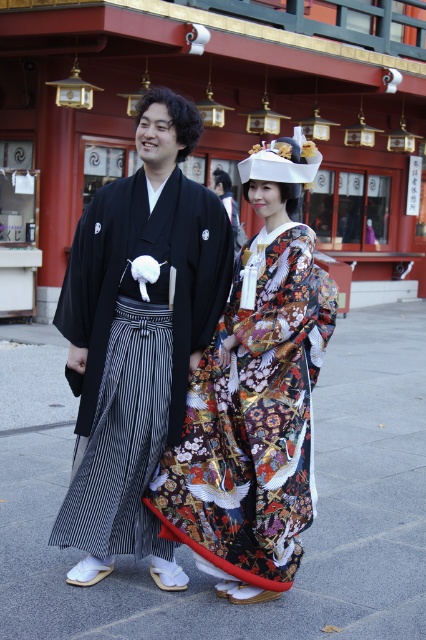
Question: Which object is closer to the camera taking this photo?

Choices:
 (A) colorful silk kimono at center
 (B) black silk kimono at center

Answer: (A)

Question: Is black silk kimono at center positioned behind colorful silk kimono at center?

Choices:
 (A) yes
 (B) no

Answer: (A)

Question: Among these points, which one is farthest from the camera?

Choices:
 (A) (89, 364)
 (B) (275, 376)

Answer: (A)

Question: Among these points, which one is farthest from the camera?

Choices:
 (A) (258, 452)
 (B) (190, 188)

Answer: (B)

Question: Does black silk kimono at center appear on the left side of colorful silk kimono at center?

Choices:
 (A) yes
 (B) no

Answer: (A)

Question: Observing the image, what is the correct spatial positioning of black silk kimono at center in reference to colorful silk kimono at center?

Choices:
 (A) right
 (B) left

Answer: (B)